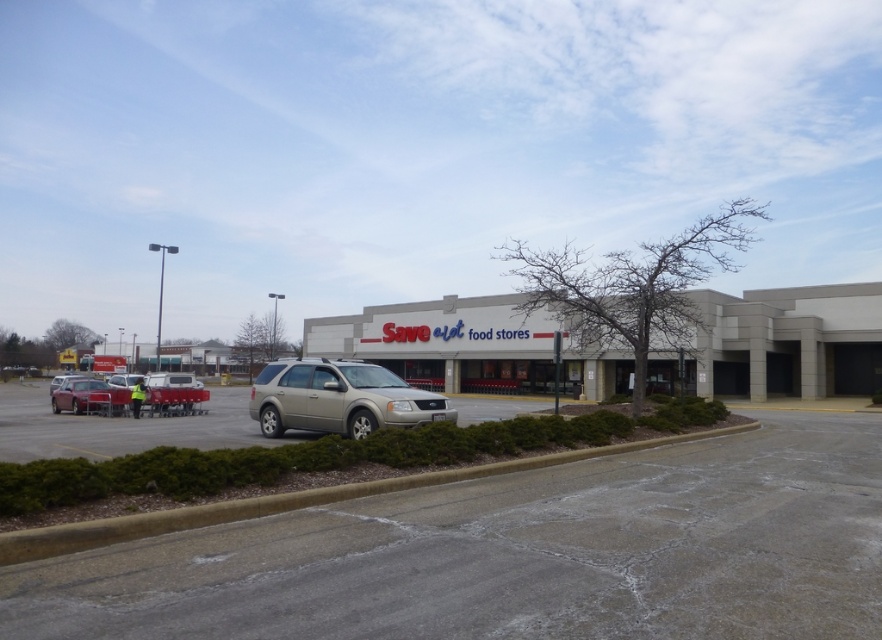
Question: Can you confirm if gold metallic suv at center is bigger than matte silver suv at left?

Choices:
 (A) yes
 (B) no

Answer: (B)

Question: Which of these objects is positioned closest to the white concrete mall at center?

Choices:
 (A) concrete at lower center
 (B) matte silver suv at center

Answer: (B)

Question: Does white concrete mall at center have a larger size compared to matte red car at left?

Choices:
 (A) no
 (B) yes

Answer: (B)

Question: Among these points, which one is farthest from the camera?

Choices:
 (A) (116, 403)
 (B) (70, 376)
 (C) (368, 397)
 (D) (845, 317)

Answer: (B)

Question: Is metallic silver suv at center positioned at the back of gold metallic suv at center?

Choices:
 (A) no
 (B) yes

Answer: (A)

Question: Among these points, which one is farthest from the camera?

Choices:
 (A) (13, 424)
 (B) (607, 376)

Answer: (B)